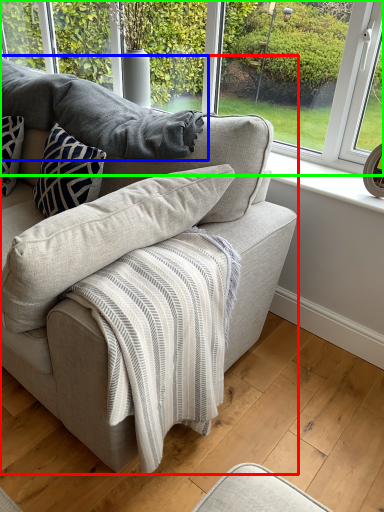
Question: Which object is positioned farthest from studio couch (highlighted by a red box)? Select from gray (highlighted by a blue box) and window (highlighted by a green box).

Choices:
 (A) gray
 (B) window

Answer: (B)